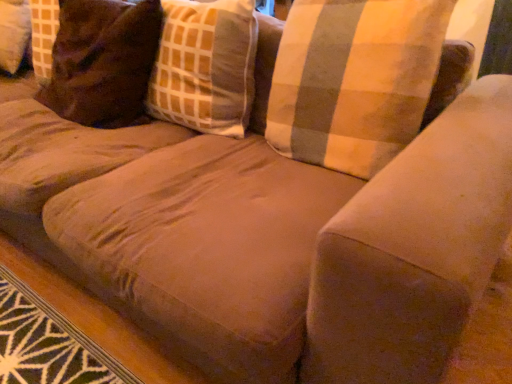
Question: Considering the relative positions of plaid fabric pillow at center and brown suede pillow at upper left, positioned as the first pillow in left-to-right order, in the image provided, is plaid fabric pillow at center to the left of brown suede pillow at upper left, positioned as the first pillow in left-to-right order, from the viewer's perspective?

Choices:
 (A) no
 (B) yes

Answer: (A)

Question: Is plaid fabric pillow at center looking in the opposite direction of brown suede pillow at upper left, positioned as the first pillow in left-to-right order?

Choices:
 (A) no
 (B) yes

Answer: (A)

Question: Is the depth of plaid fabric pillow at center greater than that of brown suede pillow at upper left, which is the second pillow from right to left?

Choices:
 (A) no
 (B) yes

Answer: (A)

Question: Is plaid fabric pillow at center positioned beyond the bounds of brown suede pillow at upper left, positioned as the first pillow in left-to-right order?

Choices:
 (A) yes
 (B) no

Answer: (A)

Question: Is brown suede pillow at upper left, positioned as the first pillow in left-to-right order, inside plaid fabric pillow at center?

Choices:
 (A) no
 (B) yes

Answer: (A)

Question: From the image's perspective, is plaid fabric pillow at center beneath brown suede pillow at upper left, positioned as the first pillow in left-to-right order?

Choices:
 (A) yes
 (B) no

Answer: (A)

Question: Would you say plaid fabric pillow at center contains plaid fabric pillow at upper right, placed as the second pillow when sorted from left to right?

Choices:
 (A) yes
 (B) no

Answer: (B)

Question: Is plaid fabric pillow at center turned away from plaid fabric pillow at upper right, the 1th pillow positioned from the right?

Choices:
 (A) no
 (B) yes

Answer: (A)

Question: Would you say plaid fabric pillow at center is outside plaid fabric pillow at upper right, placed as the second pillow when sorted from left to right?

Choices:
 (A) yes
 (B) no

Answer: (A)

Question: From the image's perspective, would you say plaid fabric pillow at center is positioned over plaid fabric pillow at upper right, placed as the second pillow when sorted from left to right?

Choices:
 (A) no
 (B) yes

Answer: (B)

Question: Can you confirm if plaid fabric pillow at center is bigger than plaid fabric pillow at upper right, placed as the second pillow when sorted from left to right?

Choices:
 (A) yes
 (B) no

Answer: (B)

Question: Is plaid fabric pillow at center at the left side of plaid fabric pillow at upper right, placed as the second pillow when sorted from left to right?

Choices:
 (A) no
 (B) yes

Answer: (B)

Question: From the image's perspective, is plaid fabric pillow at upper right, the 1th pillow positioned from the right, located beneath brown suede pillow at upper left, positioned as the first pillow in left-to-right order?

Choices:
 (A) no
 (B) yes

Answer: (B)